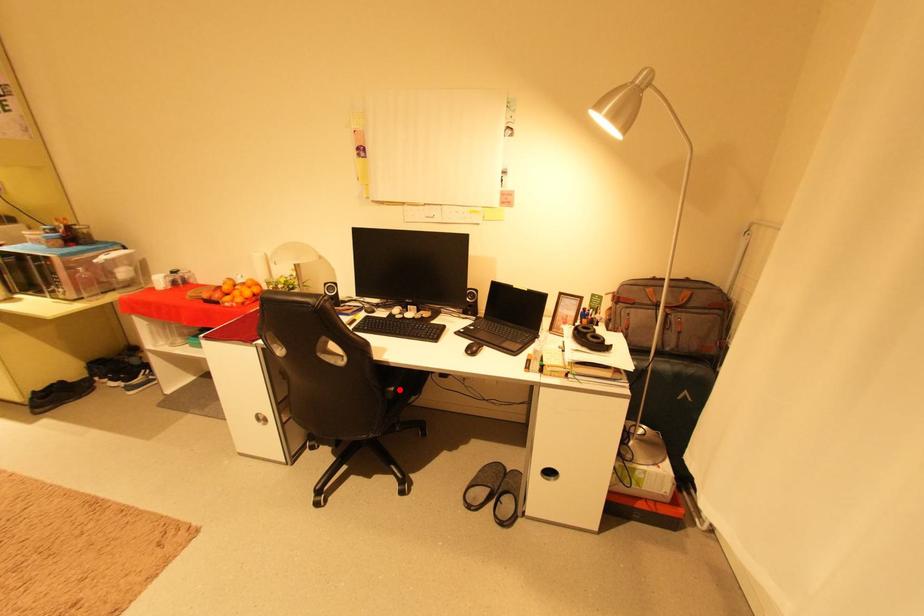
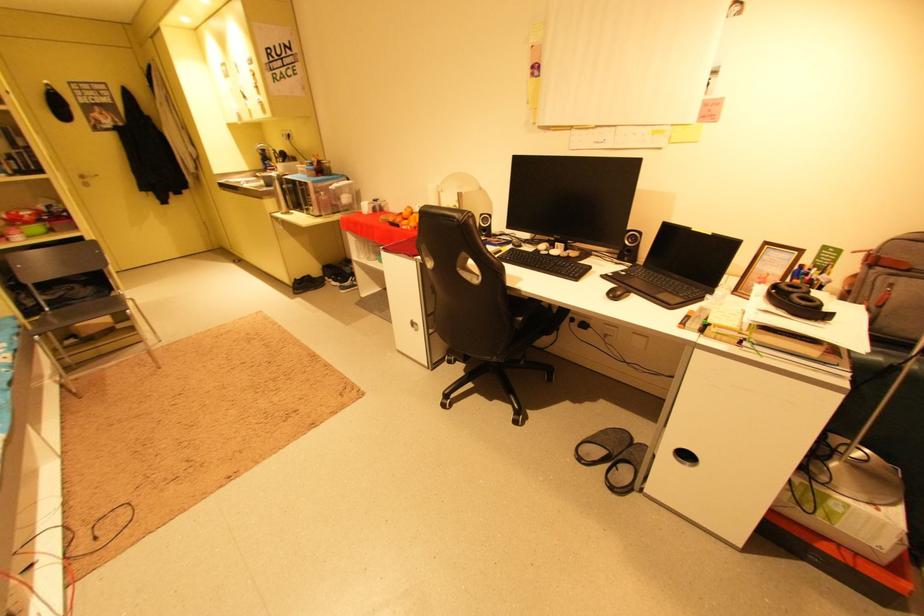
Locate, in the second image, the point that corresponds to the highlighted location in the first image.

(529, 320)